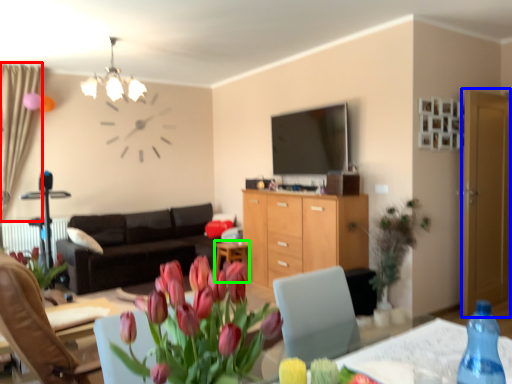
Question: Estimate the real-world distances between objects in this image. Which object is closer to curtain (highlighted by a red box), glass door (highlighted by a blue box) or desk (highlighted by a green box)?

Choices:
 (A) glass door
 (B) desk

Answer: (B)